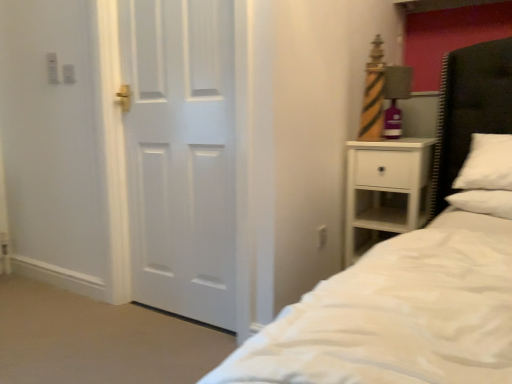
I want to click on free space that is to the left of white glossy door at left, so click(84, 325).